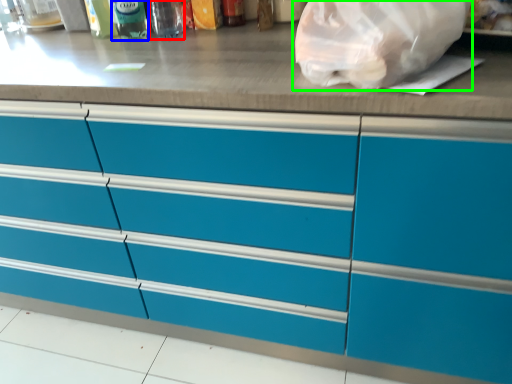
Question: Which object is positioned closest to bottle (highlighted by a red box)? Select from bottle (highlighted by a blue box) and plastic bag (highlighted by a green box).

Choices:
 (A) bottle
 (B) plastic bag

Answer: (A)